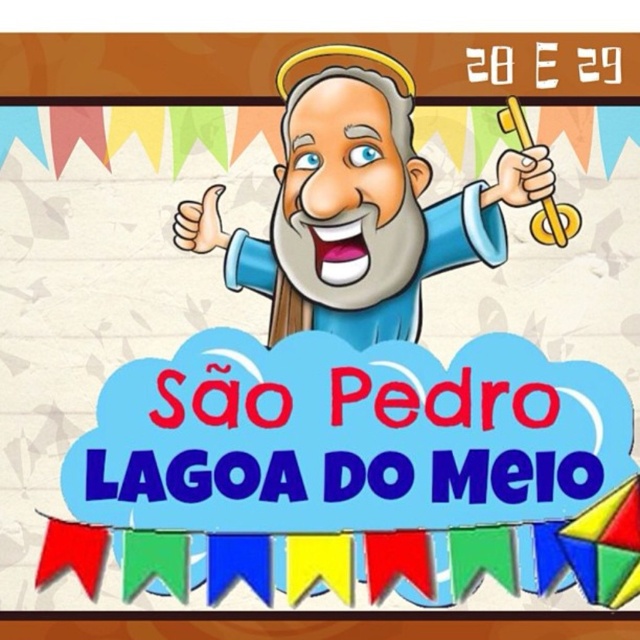
Question: Based on their relative distances, which object is farther from the cartoon blue robe at center?

Choices:
 (A) gold metallic key at upper right
 (B) blue matte/soft robe at center

Answer: (A)

Question: Can you confirm if cartoon blue robe at center is wider than gold metallic key at upper right?

Choices:
 (A) yes
 (B) no

Answer: (A)

Question: Does cartoon blue robe at center come in front of blue matte/soft robe at center?

Choices:
 (A) yes
 (B) no

Answer: (A)

Question: Which object is positioned closest to the cartoon blue robe at center?

Choices:
 (A) blue matte/soft robe at center
 (B) gold metallic key at upper right

Answer: (A)

Question: Which object appears closest to the camera in this image?

Choices:
 (A) cartoon blue robe at center
 (B) blue matte/soft robe at center

Answer: (A)

Question: Does cartoon blue robe at center have a larger size compared to gold metallic key at upper right?

Choices:
 (A) no
 (B) yes

Answer: (B)